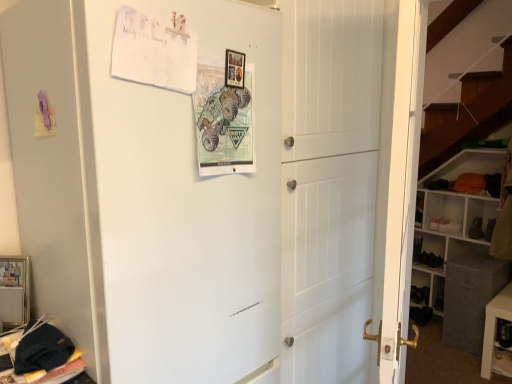
Question: From the image's perspective, is white paper postcard at upper left, which appears as the 1th postcard when viewed from the left, located above or below white wooden bookshelf at right?

Choices:
 (A) above
 (B) below

Answer: (A)

Question: Considering the positions of white paper postcard at upper left, which is the second postcard in right-to-left order, and white wooden bookshelf at right in the image, is white paper postcard at upper left, which is the second postcard in right-to-left order, bigger or smaller than white wooden bookshelf at right?

Choices:
 (A) small
 (B) big

Answer: (A)

Question: Which object is the closest to the black leather shoe at right, the 1th shoe from the left?

Choices:
 (A) white matte refrigerator at upper left
 (B) black leather shoe at lower right, placed as the second shoe when sorted from left to right
 (C) white wooden bookshelf at right
 (D) matte paper postcard at center, placed as the 2th postcard when sorted from left to right
 (E) white paper postcard at upper left, which is the second postcard in right-to-left order

Answer: (B)

Question: Estimate the real-world distances between objects in this image. Which object is farther from the white matte refrigerator at upper left?

Choices:
 (A) black leather shoe at lower right, which ranks as the first shoe in right-to-left order
 (B) white wooden bookshelf at right
 (C) matte paper postcard at center, which ranks as the 1th postcard in right-to-left order
 (D) black leather shoe at right, which is counted as the second shoe, starting from the right
 (E) black fabric cabinet at lower right

Answer: (A)